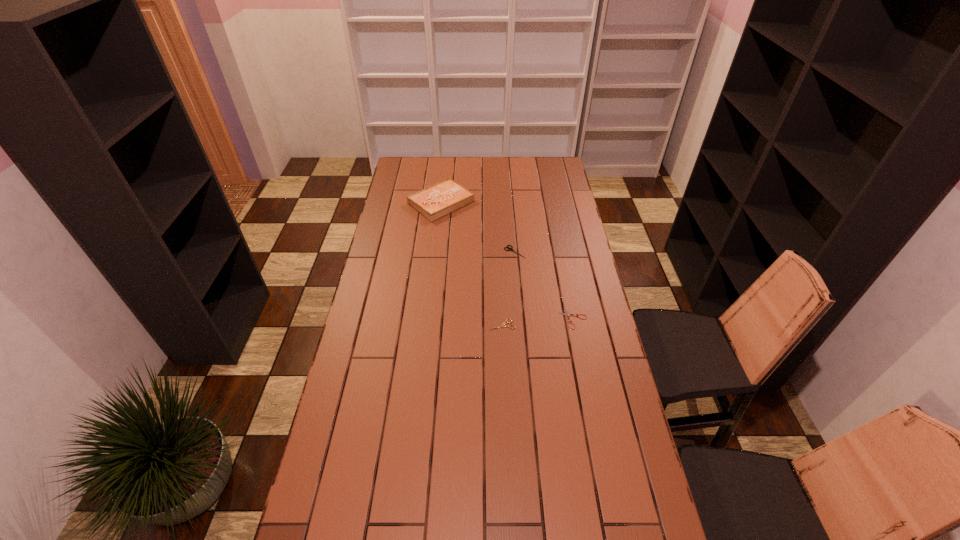
Identify the location of free region located on the front of the shortest shears. (595, 428).

At what (x,y) coordinates should I click in order to perform the action: click on object that is at the left edge. Please return your answer as a coordinate pair (x, y). The image size is (960, 540). Looking at the image, I should click on (438, 200).

Identify the location of object present at the right edge. (567, 314).

Where is `vacant area at the far edge`? This screenshot has width=960, height=540. vacant area at the far edge is located at coordinates (507, 173).

In the image, there is a desktop. What are the coordinates of `vacant space at the left edge` in the screenshot? It's located at (358, 323).

Find the location of a particular element. This screenshot has height=540, width=960. blank area at the right edge is located at coordinates (581, 237).

This screenshot has width=960, height=540. What are the coordinates of `vacant space at the far left corner of the desktop` in the screenshot? It's located at pyautogui.click(x=410, y=167).

You are a GUI agent. You are given a task and a screenshot of the screen. Output one action in this format:
    pyautogui.click(x=<x>, y=<y>)
    Task: Click on the vacant space at the far right corner
    This screenshot has width=960, height=540.
    Given the screenshot: What is the action you would take?
    pyautogui.click(x=544, y=176)

Where is `free spot between the second tallest object and the third tallest object`? Image resolution: width=960 pixels, height=540 pixels. free spot between the second tallest object and the third tallest object is located at coordinates (509, 288).

Where is `vacant space that is in between the tallest object and the shortest shears`? The image size is (960, 540). vacant space that is in between the tallest object and the shortest shears is located at coordinates (507, 260).